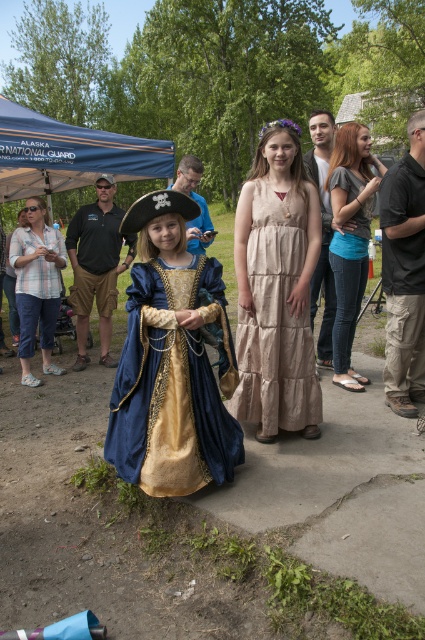
Can you confirm if velvet gold dress at center is shorter than matte pirate hat at center?

No, velvet gold dress at center is not shorter than matte pirate hat at center.

Measure the distance between velvet gold dress at center and camera.

velvet gold dress at center and camera are 2.68 meters apart from each other.

The width and height of the screenshot is (425, 640). I want to click on velvet gold dress at center, so coord(170,387).

Which of these two, beige cotton dress at center or blue fabric canopy at upper left, stands shorter?

blue fabric canopy at upper left is shorter.

Is beige cotton dress at center to the right of blue fabric canopy at upper left from the viewer's perspective?

Correct, you'll find beige cotton dress at center to the right of blue fabric canopy at upper left.

Between point (272, 392) and point (125, 179), which one is positioned in front?

Point (272, 392) is more forward.

Image resolution: width=425 pixels, height=640 pixels. In order to click on beige cotton dress at center in this screenshot , I will do `click(275, 316)`.

What do you see at coordinates (170, 387) in the screenshot?
I see `velvet gold dress at center` at bounding box center [170, 387].

Does velvet gold dress at center have a lesser height compared to beige cotton dress at center?

Yes, velvet gold dress at center is shorter than beige cotton dress at center.

The width and height of the screenshot is (425, 640). Find the location of `velvet gold dress at center`. velvet gold dress at center is located at coordinates (170, 387).

Image resolution: width=425 pixels, height=640 pixels. I want to click on velvet gold dress at center, so click(170, 387).